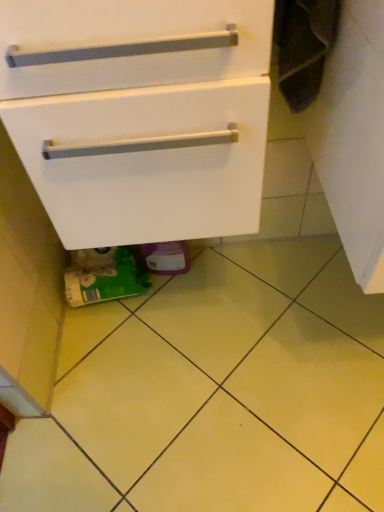
Identify the location of white matte cabinet at center. (141, 117).

What do you see at coordinates (141, 117) in the screenshot? Image resolution: width=384 pixels, height=512 pixels. I see `white matte cabinet at center` at bounding box center [141, 117].

What do you see at coordinates (216, 392) in the screenshot? The width and height of the screenshot is (384, 512). I see `yellow matte tile at lower center` at bounding box center [216, 392].

Locate an element on the screen. This screenshot has height=512, width=384. yellow matte tile at lower center is located at coordinates (216, 392).

Where is `white matte cabinet at center`? The width and height of the screenshot is (384, 512). white matte cabinet at center is located at coordinates (141, 117).

Would you say white matte cabinet at center is to the left or to the right of yellow matte tile at lower center in the picture?

Clearly, white matte cabinet at center is on the left of yellow matte tile at lower center in the image.

Which object is closer to the camera, white matte cabinet at center or yellow matte tile at lower center?

white matte cabinet at center is in front.

Is point (92, 142) in front of point (146, 347)?

That is True.

From the picture: From the image's perspective, between white matte cabinet at center and yellow matte tile at lower center, which one is located above?

white matte cabinet at center, from the image's perspective.

From a real-world perspective, is white matte cabinet at center physically below yellow matte tile at lower center?

No, from a real-world perspective, white matte cabinet at center is not below yellow matte tile at lower center.

Looking at this image, which object is wider, white matte cabinet at center or yellow matte tile at lower center?

With larger width is yellow matte tile at lower center.

Considering the sizes of objects white matte cabinet at center and yellow matte tile at lower center in the image provided, who is taller, white matte cabinet at center or yellow matte tile at lower center?

white matte cabinet at center.

Can you confirm if white matte cabinet at center is bigger than yellow matte tile at lower center?

Yes, white matte cabinet at center is bigger than yellow matte tile at lower center.

Is yellow matte tile at lower center completely or partially inside white matte cabinet at center?

No, yellow matte tile at lower center is not inside white matte cabinet at center.

Is there a large distance between white matte cabinet at center and yellow matte tile at lower center?

No.

Could you tell me if white matte cabinet at center is facing yellow matte tile at lower center?

No, white matte cabinet at center is not facing towards yellow matte tile at lower center.

How different are the orientations of white matte cabinet at center and yellow matte tile at lower center in degrees?

white matte cabinet at center and yellow matte tile at lower center are facing 89.6 degrees away from each other.

Measure the distance from white matte cabinet at center to yellow matte tile at lower center.

white matte cabinet at center and yellow matte tile at lower center are 22.67 inches apart from each other.

This screenshot has width=384, height=512. I want to click on cabinetry above the yellow matte tile at lower center (from the image's perspective), so click(x=141, y=117).

Which is more to the left, yellow matte tile at lower center or white matte cabinet at center?

white matte cabinet at center is more to the left.

Which is behind, yellow matte tile at lower center or white matte cabinet at center?

yellow matte tile at lower center.

Which is in front, point (362, 382) or point (254, 40)?

The point (254, 40) is more forward.

From the image's perspective, is yellow matte tile at lower center located above white matte cabinet at center?

No, from the image's perspective, yellow matte tile at lower center is not over white matte cabinet at center.

From a real-world perspective, is yellow matte tile at lower center positioned above or below white matte cabinet at center?

In terms of real-world spatial position, yellow matte tile at lower center is below white matte cabinet at center.

Which object is thinner, yellow matte tile at lower center or white matte cabinet at center?

Thinner between the two is white matte cabinet at center.

Looking at this image, between yellow matte tile at lower center and white matte cabinet at center, which one has less height?

With less height is yellow matte tile at lower center.

Based on their sizes in the image, would you say yellow matte tile at lower center is bigger or smaller than white matte cabinet at center?

Clearly, yellow matte tile at lower center is smaller in size than white matte cabinet at center.

Which is correct: yellow matte tile at lower center is inside white matte cabinet at center, or outside of it?

yellow matte tile at lower center lies outside white matte cabinet at center.

Is yellow matte tile at lower center beside white matte cabinet at center?

yellow matte tile at lower center and white matte cabinet at center are clearly separated.

Does yellow matte tile at lower center turn towards white matte cabinet at center?

No.

Find the location of a particular element. This screenshot has width=384, height=512. cabinetry to the left of yellow matte tile at lower center is located at coordinates (141, 117).

Locate an element on the screen. The height and width of the screenshot is (512, 384). cabinetry above the yellow matte tile at lower center (from the image's perspective) is located at coordinates (141, 117).

This screenshot has width=384, height=512. I want to click on cabinetry located above the yellow matte tile at lower center (from a real-world perspective), so click(x=141, y=117).